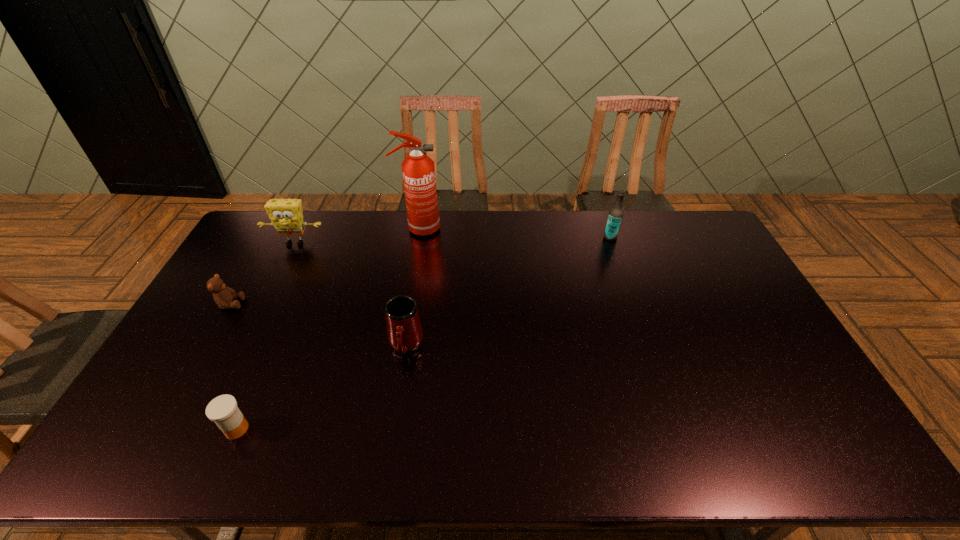
I want to click on free region located 0.400m on the label of the beer bottle, so click(498, 237).

Locate an element on the screen. This screenshot has width=960, height=540. free region located 0.290m on the face of the sponge is located at coordinates (263, 308).

Where is `vacant space located 0.060m on the side of the fifth farthest object with the handle`? The image size is (960, 540). vacant space located 0.060m on the side of the fifth farthest object with the handle is located at coordinates (400, 383).

I want to click on free space located on the face of the teddy bear, so click(x=293, y=304).

What are the coordinates of `free space located 0.090m on the label of the medicine` in the screenshot? It's located at (286, 429).

Where is `fire extinguisher that is at the far edge`? fire extinguisher that is at the far edge is located at coordinates (418, 170).

Identify the location of beer bottle located in the far edge section of the desktop. The width and height of the screenshot is (960, 540). (615, 216).

At what (x,y) coordinates should I click in order to perform the action: click on sponge that is at the far edge. Please return your answer as a coordinate pair (x, y). The image size is (960, 540). Looking at the image, I should click on (286, 215).

Locate an element on the screen. object present at the near edge is located at coordinates (223, 410).

At what (x,y) coordinates should I click in order to perform the action: click on sponge positioned at the left edge. Please return your answer as a coordinate pair (x, y). Looking at the image, I should click on (286, 215).